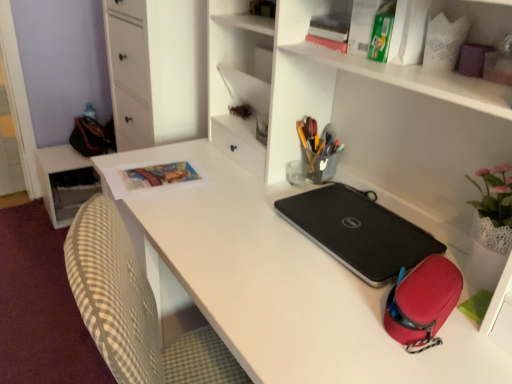
This screenshot has width=512, height=384. Find the location of `white glossy table at lower left`. white glossy table at lower left is located at coordinates (57, 187).

Measure the distance between matte paper book at upper left and camera.

matte paper book at upper left is 3.95 feet away from camera.

What is the approximate height of matte paper book at upper left?

It is 0.53 inches.

This screenshot has width=512, height=384. What do you see at coordinates (359, 232) in the screenshot? I see `black textured laptop at center` at bounding box center [359, 232].

What is the approximate width of white matte file cabinet at upper left?

white matte file cabinet at upper left is 17.79 inches wide.

Identify the location of white glossy table at lower left. (57, 187).

From the image's perspective, is black textured laptop at center above or below matte paper book at upper left?

black textured laptop at center is situated lower than matte paper book at upper left in the image.

Is black textured laptop at center oriented away from matte paper book at upper left?

No, matte paper book at upper left is not at the back of black textured laptop at center.

Is black textured laptop at center positioned far away from matte paper book at upper left?

black textured laptop at center is actually quite close to matte paper book at upper left.

Considering the positions of points (291, 204) and (196, 175), is point (291, 204) farther from camera compared to point (196, 175)?

No, (291, 204) is in front of (196, 175).

From the image's perspective, between white glossy table at lower left and metallic silver pen holder at center, who is located below?

white glossy table at lower left is shown below in the image.

Which object is more forward, white glossy table at lower left or metallic silver pen holder at center?

metallic silver pen holder at center.

Are white glossy table at lower left and metallic silver pen holder at center far apart?

Yes.

Does white glossy table at lower left have a larger size compared to metallic silver pen holder at center?

Indeed, white glossy table at lower left has a larger size compared to metallic silver pen holder at center.

From the picture: From the image's perspective, which is below, metallic silver pen holder at center or black textured laptop at center?

From the image's view, black textured laptop at center is below.

Is point (313, 131) farther from viewer compared to point (361, 265)?

Yes, it is behind point (361, 265).

Are metallic silver pen holder at center and black textured laptop at center far apart?

No.

Would you say metallic silver pen holder at center is to the left or to the right of black textured laptop at center in the picture?

Based on their positions, metallic silver pen holder at center is located to the left of black textured laptop at center.

Is metallic silver pen holder at center facing away from matte paper book at upper left?

No, metallic silver pen holder at center's orientation is not away from matte paper book at upper left.

Is metallic silver pen holder at center at the left side of matte paper book at upper left?

Incorrect, metallic silver pen holder at center is not on the left side of matte paper book at upper left.

Between metallic silver pen holder at center and matte paper book at upper left, which one has smaller width?

Thinner between the two is metallic silver pen holder at center.

Which of these two, metallic silver pen holder at center or matte paper book at upper left, stands taller?

metallic silver pen holder at center.

Measure the distance between white glossy table at lower left and white matte file cabinet at upper left.

The distance of white glossy table at lower left from white matte file cabinet at upper left is 27.79 inches.

Is white glossy table at lower left bigger or smaller than white matte file cabinet at upper left?

Considering their sizes, white glossy table at lower left takes up less space than white matte file cabinet at upper left.

From a real-world perspective, is white glossy table at lower left physically located above or below white matte file cabinet at upper left?

From a real-world perspective, white glossy table at lower left is physically below white matte file cabinet at upper left.

Is white matte file cabinet at upper left completely or partially inside white glossy table at lower left?

Actually, white matte file cabinet at upper left is outside white glossy table at lower left.

In the scene shown: Which is closer, (395, 268) or (321, 170)?

Point (395, 268).

Can you confirm if black textured laptop at center is taller than metallic silver pen holder at center?

No, black textured laptop at center is not taller than metallic silver pen holder at center.

Between black textured laptop at center and metallic silver pen holder at center, which one is positioned behind?

metallic silver pen holder at center is more distant.

In terms of size, does black textured laptop at center appear bigger or smaller than metallic silver pen holder at center?

Clearly, black textured laptop at center is larger in size than metallic silver pen holder at center.

Is matte paper book at upper left directly adjacent to white glossy table at lower left?

matte paper book at upper left and white glossy table at lower left are clearly separated.

Is white glossy table at lower left completely or partially inside matte paper book at upper left?

That's incorrect, white glossy table at lower left is not inside matte paper book at upper left.

Could you tell me if matte paper book at upper left is facing white glossy table at lower left?

No, matte paper book at upper left is not turned towards white glossy table at lower left.

Is point (169, 182) closer to viewer compared to point (45, 178)?

That is True.

Identify the location of laptop located in front of the matte paper book at upper left. The width and height of the screenshot is (512, 384). (359, 232).

Find the location of `table below the metallic silver pen holder at center (from the image's perspective)`. table below the metallic silver pen holder at center (from the image's perspective) is located at coordinates (57, 187).

From the image, which object appears to be nearer to white glossy table at lower left, metallic silver pen holder at center or matte paper book at upper left?

matte paper book at upper left.

Which object lies nearer to the anchor point metallic silver pen holder at center, black textured laptop at center or matte paper book at upper left?

black textured laptop at center lies closer to metallic silver pen holder at center than the other object.

Considering their positions, is metallic silver pen holder at center positioned closer to white matte desk at center than white glossy table at lower left?

metallic silver pen holder at center is positioned closer to the anchor white matte desk at center.

Which object lies further to the anchor point white matte desk at center, white glossy table at lower left or white matte file cabinet at upper left?

Among the two, white glossy table at lower left is located further to white matte desk at center.

Which object lies nearer to the anchor point matte paper book at upper left, black textured laptop at center or white glossy table at lower left?

black textured laptop at center is closer to matte paper book at upper left.

Considering their positions, is black textured laptop at center positioned closer to metallic silver pen holder at center than white matte desk at center?

The object closer to metallic silver pen holder at center is black textured laptop at center.

When comparing their distances from white matte file cabinet at upper left, does white glossy table at lower left or matte paper book at upper left seem closer?

Among the two, matte paper book at upper left is located nearer to white matte file cabinet at upper left.

Considering their positions, is white matte file cabinet at upper left positioned closer to white matte desk at center than white glossy table at lower left?

white matte file cabinet at upper left.

I want to click on book between white glossy table at lower left and metallic silver pen holder at center from left to right, so click(158, 175).

Find the location of a particular element. This screenshot has width=512, height=384. file cabinet between white matte desk at center and white glossy table at lower left along the z-axis is located at coordinates (157, 70).

Where is `book situated between white matte file cabinet at upper left and metallic silver pen holder at center from left to right`? book situated between white matte file cabinet at upper left and metallic silver pen holder at center from left to right is located at coordinates (158, 175).

Identify the location of file cabinet between matte paper book at upper left and white glossy table at lower left in the front-back direction. Image resolution: width=512 pixels, height=384 pixels. (157, 70).